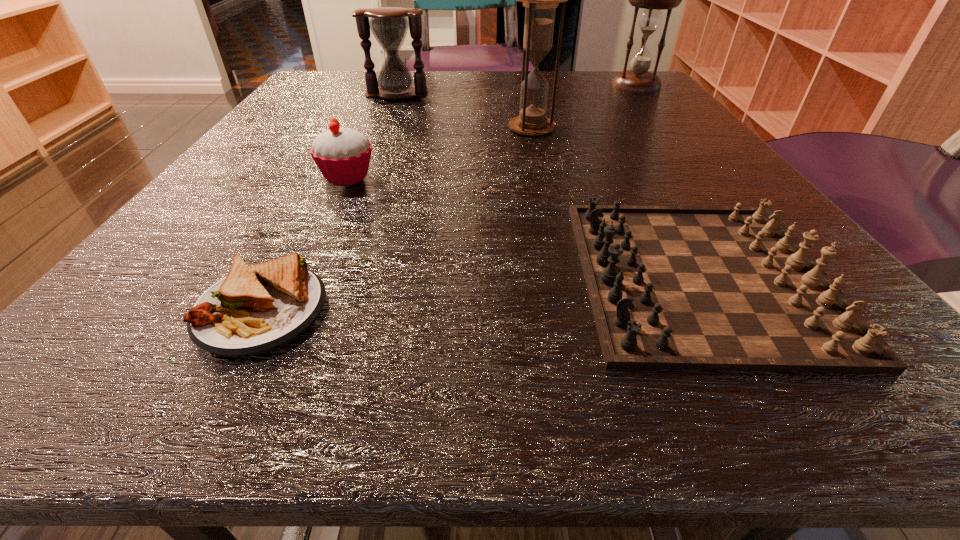
The height and width of the screenshot is (540, 960). I want to click on free spot between the rightmost hourglass and the second shortest object, so click(668, 181).

In order to click on the fifth closest object relative to the second shortest object in this screenshot , I will do `click(389, 25)`.

Identify which object is the third closest to the sandwich. Please provide its 2D coordinates. Your answer should be formatted as a tuple, i.e. [(x, y)], where the tuple contains the x and y coordinates of a point satisfying the conditions above.

[(540, 0)]

Identify which hourglass is located as the second nearest to the rightmost hourglass. Please provide its 2D coordinates. Your answer should be formatted as a tuple, i.e. [(x, y)], where the tuple contains the x and y coordinates of a point satisfying the conditions above.

[(389, 25)]

The image size is (960, 540). I want to click on hourglass that is the nearest to the leftmost hourglass, so click(540, 0).

You are a GUI agent. You are given a task and a screenshot of the screen. Output one action in this format:
    pyautogui.click(x=<x>, y=<y>)
    Task: Click on the vacant position in the image that satisfies the following two spatial constraints: 1. on the back side of the sandwich; 2. on the right side of the second shortest object
    The width and height of the screenshot is (960, 540).
    Given the screenshot: What is the action you would take?
    pyautogui.click(x=279, y=276)

The height and width of the screenshot is (540, 960). I want to click on free space that satisfies the following two spatial constraints: 1. on the back side of the rightmost hourglass; 2. on the left side of the cupcake, so click(x=390, y=86).

Locate an element on the screen. This screenshot has width=960, height=540. blank space that satisfies the following two spatial constraints: 1. on the back side of the rightmost hourglass; 2. on the left side of the cupcake is located at coordinates (390, 86).